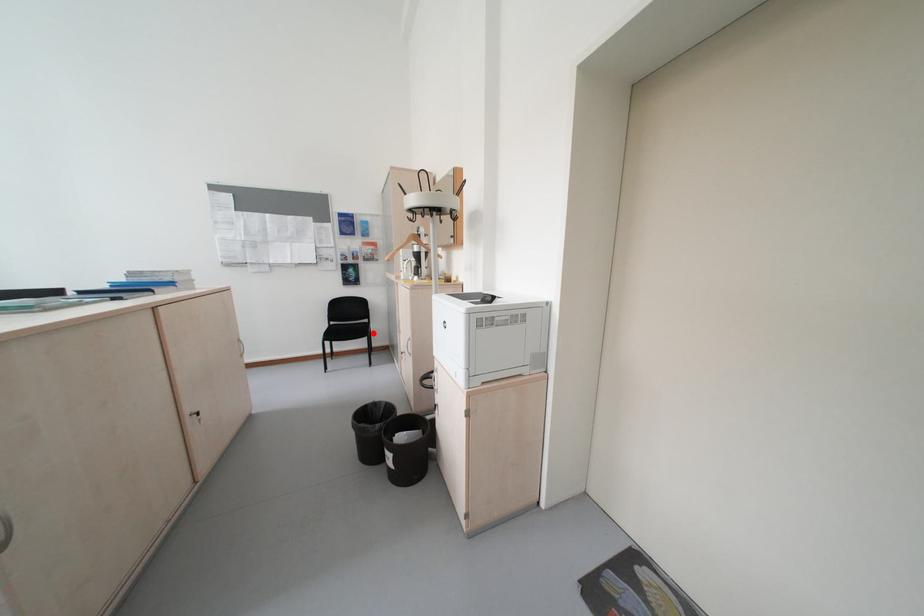
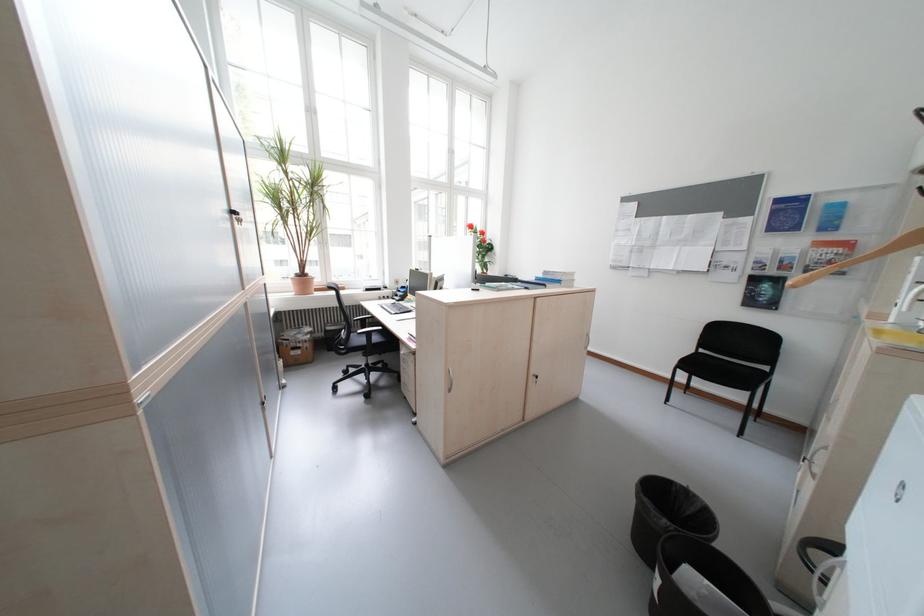
Locate, in the second image, the point that corresponds to the highlighted location in the first image.

(758, 382)